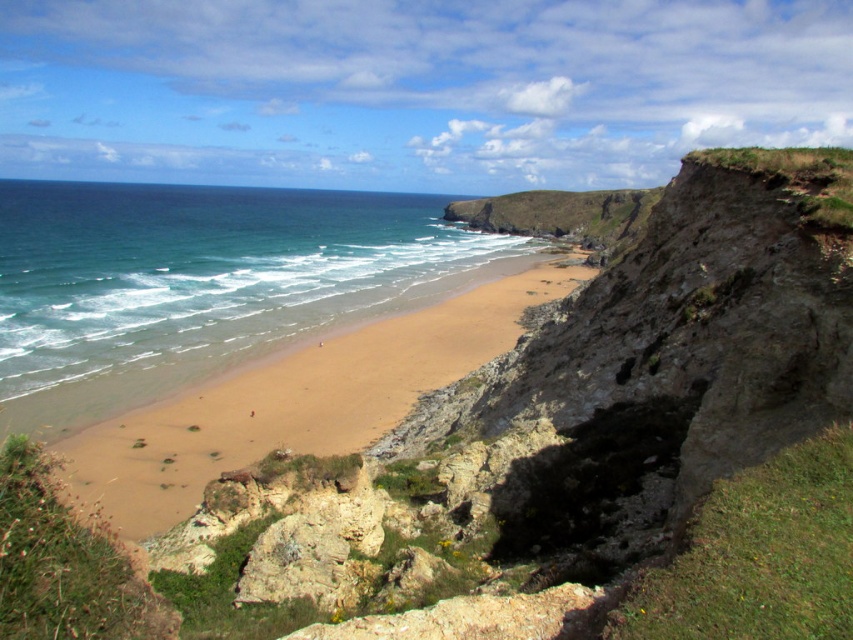
In the scene shown: Between blue water at center and brown sandy beach at center, which one is positioned lower?

brown sandy beach at center is lower down.

Is point (271, 257) in front of point (247, 400)?

No, (271, 257) is behind (247, 400).

Between point (413, 200) and point (212, 404), which one is positioned behind?

Positioned behind is point (413, 200).

Identify the location of blue water at center. (200, 282).